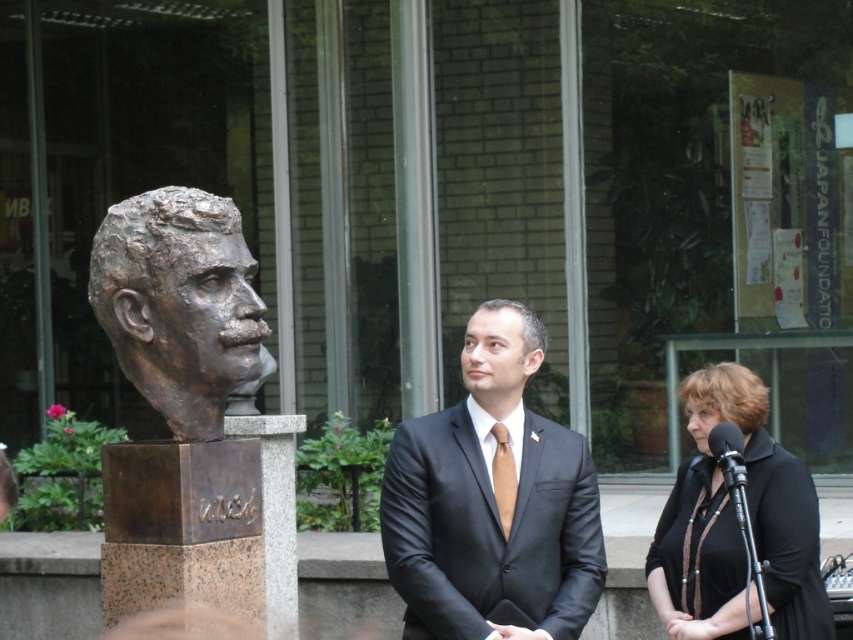
Between shiny bronze bust at center and matte brown tie at center, which one is positioned lower?

matte brown tie at center is lower down.

Find the location of a particular element. This screenshot has height=640, width=853. shiny bronze bust at center is located at coordinates (500, 353).

At what (x,y) coordinates should I click in order to perform the action: click on shiny bronze bust at center. Please return your answer as a coordinate pair (x, y). The image size is (853, 640). Looking at the image, I should click on (500, 353).

Is point (97, 285) more distant than point (711, 394)?

No.

Can you confirm if bronze sculpture at left is taller than dark brown hair at center?

Yes.

Which is in front, point (171, 236) or point (732, 394)?

Point (171, 236)

You are a GUI agent. You are given a task and a screenshot of the screen. Output one action in this format:
    pyautogui.click(x=<x>, y=<y>)
    Task: Click on the bronze sculpture at left
    
    Given the screenshot: What is the action you would take?
    pyautogui.click(x=149, y=237)

Can you confirm if shiny black suit at center is wider than dark brown hair at center?

Indeed, shiny black suit at center has a greater width compared to dark brown hair at center.

Can you confirm if shiny black suit at center is positioned above dark brown hair at center?

No.

Image resolution: width=853 pixels, height=640 pixels. I want to click on shiny black suit at center, so click(x=492, y=500).